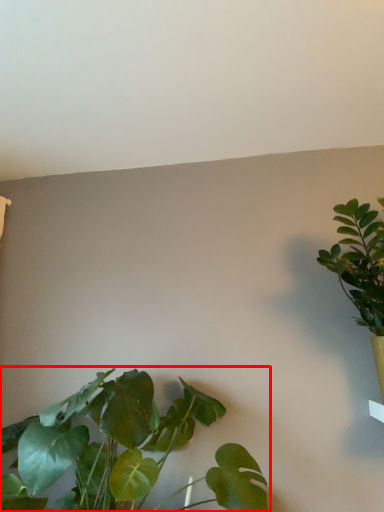
Question: Considering the relative positions of houseplant (annotated by the red box) and houseplant in the image provided, where is houseplant (annotated by the red box) located with respect to the staircase?

Choices:
 (A) left
 (B) right

Answer: (A)